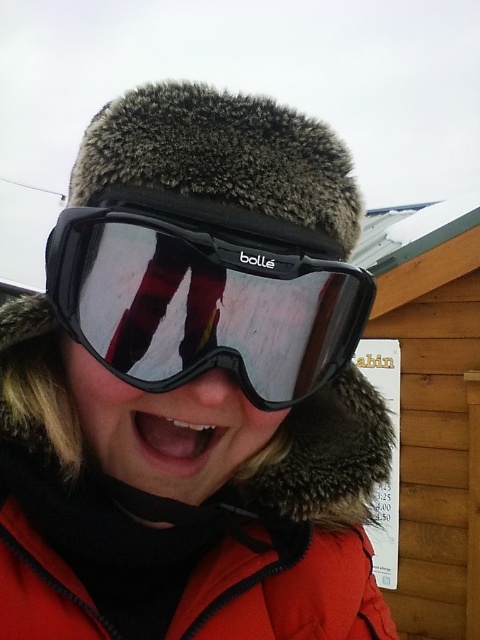
Question: Which object is the farthest from the orange fleece jacket at center?

Choices:
 (A) black matte ski goggles at center
 (B) white glossy teeth at center

Answer: (A)

Question: Can you confirm if orange fleece jacket at center is positioned to the right of white glossy teeth at center?

Choices:
 (A) no
 (B) yes

Answer: (B)

Question: Which of the following is the farthest from the observer?

Choices:
 (A) (235, 493)
 (B) (187, 451)

Answer: (A)

Question: Among these objects, which one is nearest to the camera?

Choices:
 (A) black matte ski goggles at center
 (B) orange fleece jacket at center
 (C) white glossy teeth at center

Answer: (A)

Question: Can you confirm if orange fleece jacket at center is positioned below white glossy teeth at center?

Choices:
 (A) yes
 (B) no

Answer: (A)

Question: Is black matte ski goggles at center above white glossy teeth at center?

Choices:
 (A) no
 (B) yes

Answer: (B)